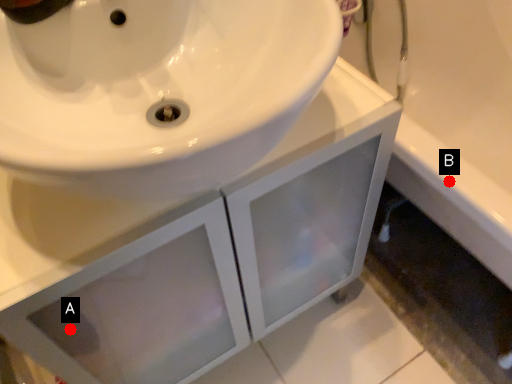
Question: Two points are circled on the image, labeled by A and B beside each circle. Which of the following is the closest to the observer?

Choices:
 (A) A is closer
 (B) B is closer

Answer: (A)